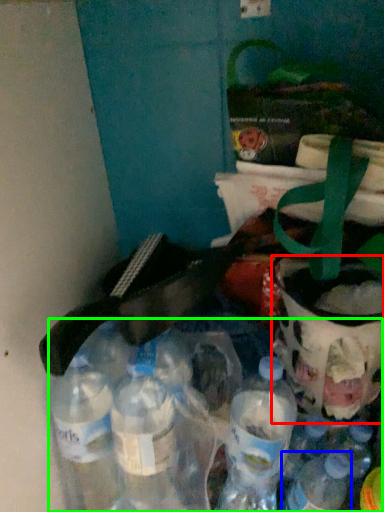
Question: Which is farther away from glass jar (highlighted by a red box)? bottle (highlighted by a blue box) or bottle (highlighted by a green box)?

Choices:
 (A) bottle
 (B) bottle

Answer: (B)